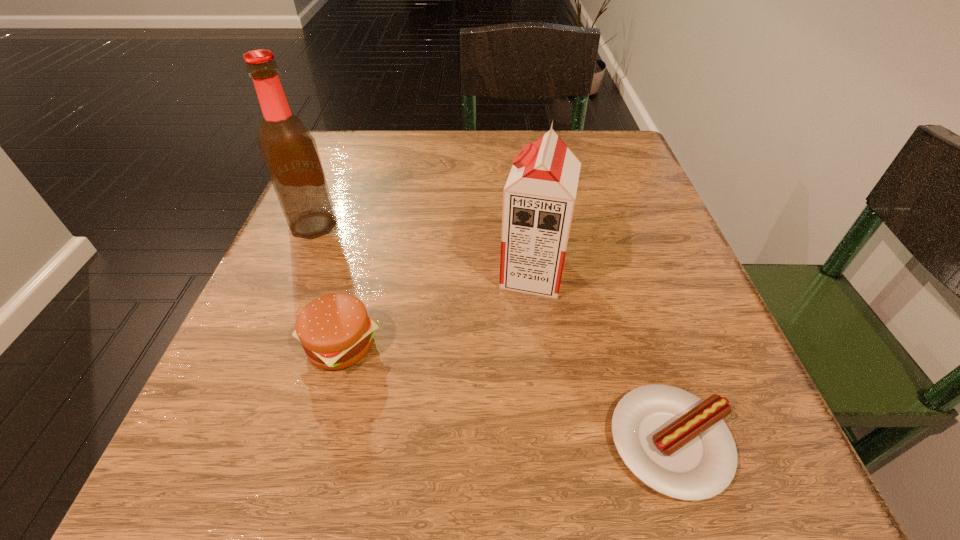
Identify the location of vacant space at the right edge. (606, 305).

The width and height of the screenshot is (960, 540). I want to click on vacant space at the far left corner, so click(332, 157).

Where is `vacant area at the far right corner of the desktop`? vacant area at the far right corner of the desktop is located at coordinates (625, 157).

In the image, there is a desktop. Identify the location of vacant space at the near right corner. The height and width of the screenshot is (540, 960). (702, 512).

Identify the location of vacant region between the farthest object and the second object from left to right. (327, 285).

Find the location of `free spot between the third shortest object and the leftmost object`. free spot between the third shortest object and the leftmost object is located at coordinates (423, 249).

Where is `vacant area that lies between the sausage and the third object from right to left`? The width and height of the screenshot is (960, 540). vacant area that lies between the sausage and the third object from right to left is located at coordinates (506, 394).

The height and width of the screenshot is (540, 960). Identify the location of unoccupied position between the tallest object and the second farthest object. (423, 249).

This screenshot has width=960, height=540. I want to click on vacant area that lies between the rightmost object and the tallest object, so click(492, 334).

Identify the location of free space between the beer bottle and the third shortest object. (423, 249).